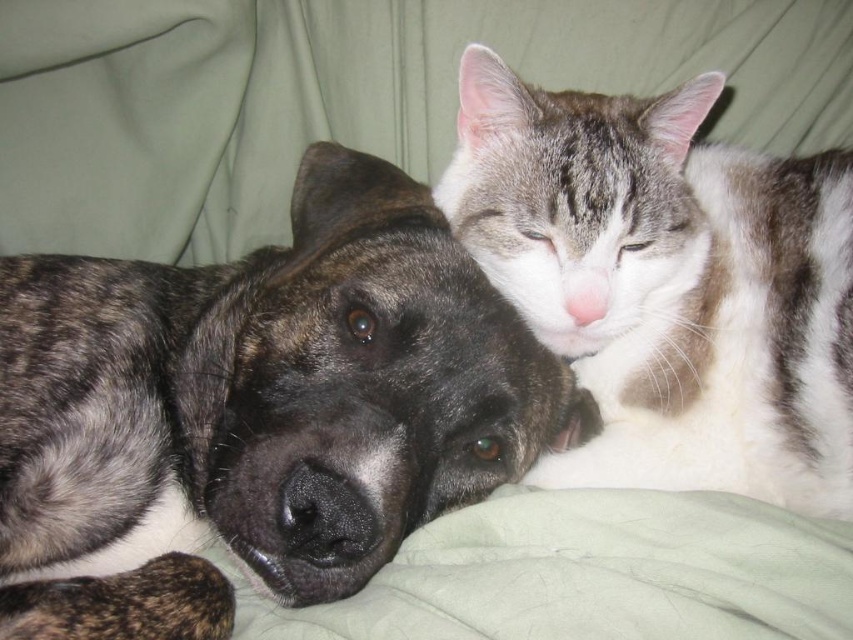
Who is lower down, brindle fur dog at center or gray and white fur cat at upper right?

brindle fur dog at center is below.

In the scene shown: Can you confirm if brindle fur dog at center is taller than gray and white fur cat at upper right?

Yes, brindle fur dog at center is taller than gray and white fur cat at upper right.

Which is behind, point (247, 269) or point (677, 189)?

The point (247, 269) is behind.

This screenshot has height=640, width=853. I want to click on brindle fur dog at center, so click(256, 412).